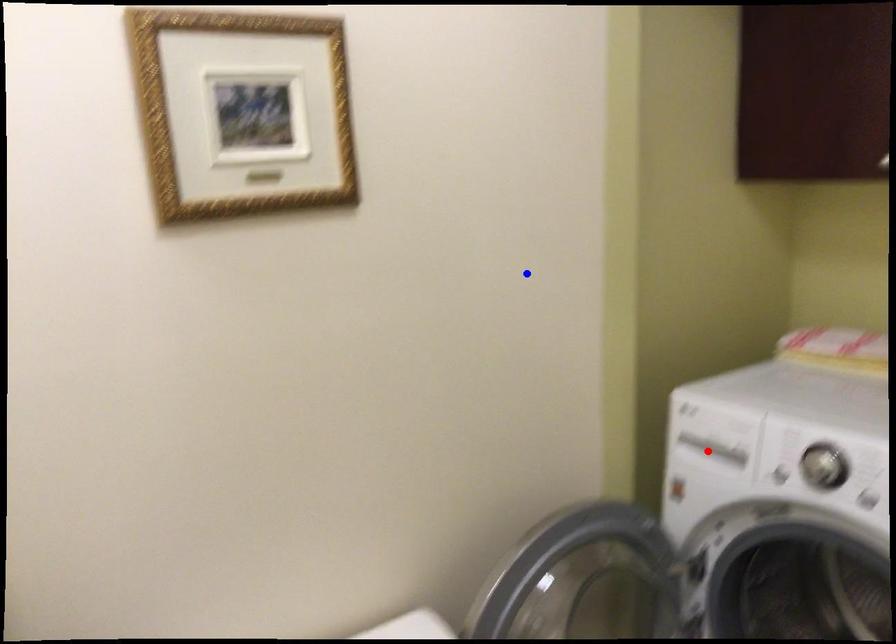
Question: Which of the two points in the image is closer to the camera?

Choices:
 (A) Blue point is closer.
 (B) Red point is closer.

Answer: (A)